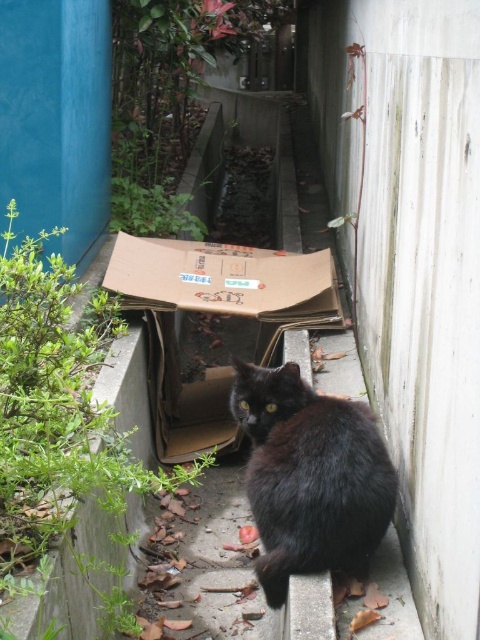
Does black fur cat at center appear under brown cardboard box at center?

Indeed, black fur cat at center is positioned under brown cardboard box at center.

Is point (266, 580) farther from camera compared to point (120, 250)?

No, it is not.

You are a GUI agent. You are given a task and a screenshot of the screen. Output one action in this format:
    pyautogui.click(x=<x>, y=<y>)
    Task: Click on the black fur cat at center
    
    Given the screenshot: What is the action you would take?
    pyautogui.click(x=311, y=477)